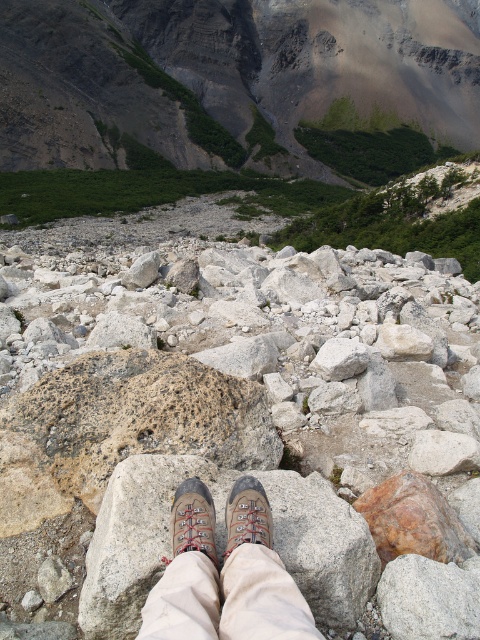
Between rugged granite mountain at upper center and brown suede shoe at center, which one has less height?

With less height is brown suede shoe at center.

Between point (127, 38) and point (176, 541), which one is positioned in front?

Point (176, 541) is in front.

Who is more distant from viewer, (458, 3) or (173, 518)?

Point (458, 3)

Find the location of a particular element. rugged granite mountain at upper center is located at coordinates (228, 74).

Who is more distant from viewer, (173, 556) or (212, 500)?

Positioned behind is point (212, 500).

The width and height of the screenshot is (480, 640). Describe the element at coordinates (225, 573) in the screenshot. I see `brown leather boots at center` at that location.

Locate an element on the screen. The height and width of the screenshot is (640, 480). brown leather boots at center is located at coordinates (225, 573).

Can you confirm if speckled rock at center is taller than brown suede shoe at center?

Indeed, speckled rock at center has a greater height compared to brown suede shoe at center.

Is speckled rock at center below brown suede shoe at center?

Incorrect, speckled rock at center is not positioned below brown suede shoe at center.

What do you see at coordinates (237, 426) in the screenshot? I see `speckled rock at center` at bounding box center [237, 426].

Identify the location of speckled rock at center. The height and width of the screenshot is (640, 480). (237, 426).